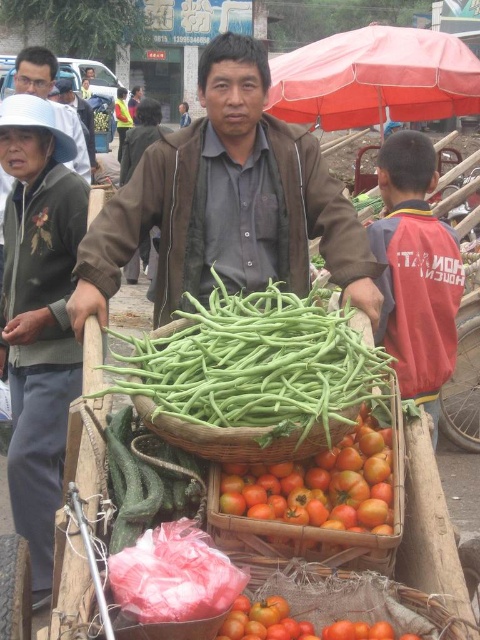
Who is more forward, (x=240, y=176) or (x=268, y=346)?

Point (x=268, y=346) is in front.

Describe the element at coordinates (228, 204) in the screenshot. The width and height of the screenshot is (480, 640). I see `brown woolen jacket at center` at that location.

Locate an element on the screen. This screenshot has height=640, width=480. brown woolen jacket at center is located at coordinates (228, 204).

Which is more to the left, green matte string beans at center or green matte hat at upper left?

From the viewer's perspective, green matte hat at upper left appears more on the left side.

Does green matte string beans at center have a lesser height compared to green matte hat at upper left?

Yes, green matte string beans at center is shorter than green matte hat at upper left.

Is point (224, 426) positioned before point (66, 192)?

That is True.

Where is `green matte string beans at center`? green matte string beans at center is located at coordinates (251, 376).

Can you confirm if brown cotton shirt at center is taller than matte gray shirt at upper center?

Correct, brown cotton shirt at center is much taller as matte gray shirt at upper center.

Measure the distance between point (x=159, y=108) and camera.

Point (x=159, y=108) is 62.36 feet from camera.

At what (x,y) coordinates should I click in order to perform the action: click on brown cotton shirt at center. Please return your answer as a coordinate pair (x, y). Looking at the image, I should click on (141, 136).